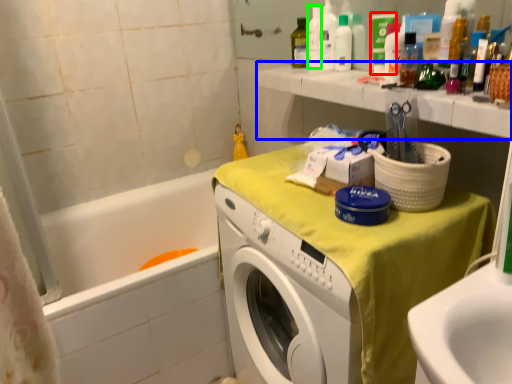
Question: Considering the real-world distances, which object is closest to toiletry (highlighted by a red box)? counter top (highlighted by a blue box) or bottle (highlighted by a green box).

Choices:
 (A) counter top
 (B) bottle

Answer: (B)